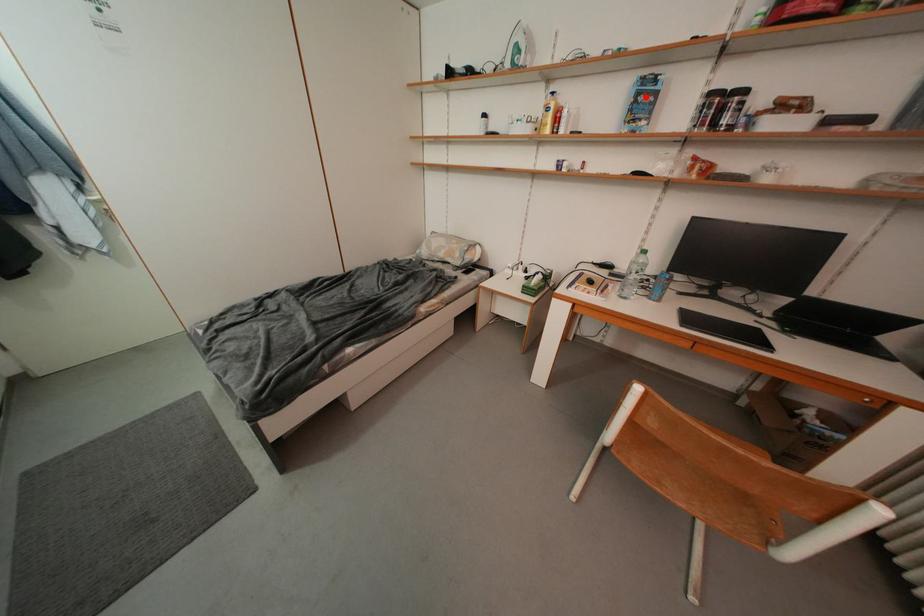
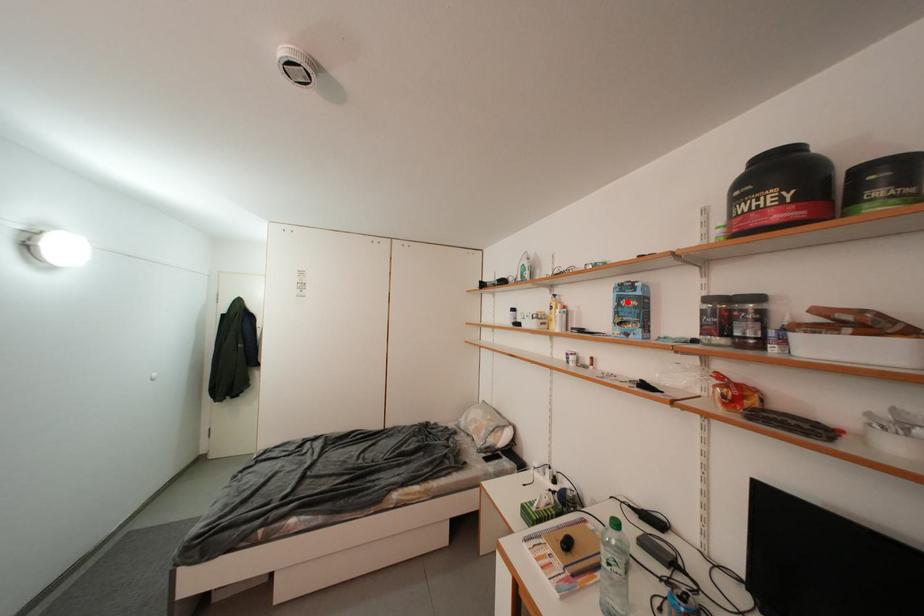
Consider the image. I am providing you with two images of the same scene from different viewpoints. A red point is marked on the first image and another point is marked on the second image. Is the marked point in image1 the same physical position as the marked point in image2?

Yes